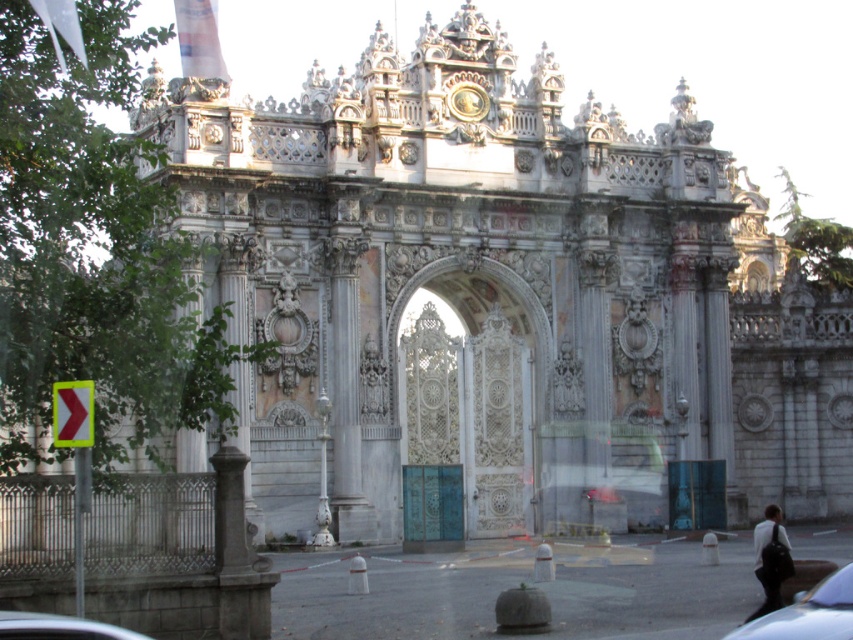
You are a photographer positioned at the entrance of the grand structure. You want to capture a photo of the white marble archway at center without any obstructions. Is the white glossy car at lower left blocking your view of the archway?

The white marble archway at center is above the white glossy car at lower left, so the car is not blocking the view of the archway since it is positioned below it.

You are standing at the entrance of the grand structure and see the white marble archway at center and the white glossy car at lower left. From your perspective, which object is positioned to the right of the other?

The white marble archway at center is to the right of the white glossy car at lower left.